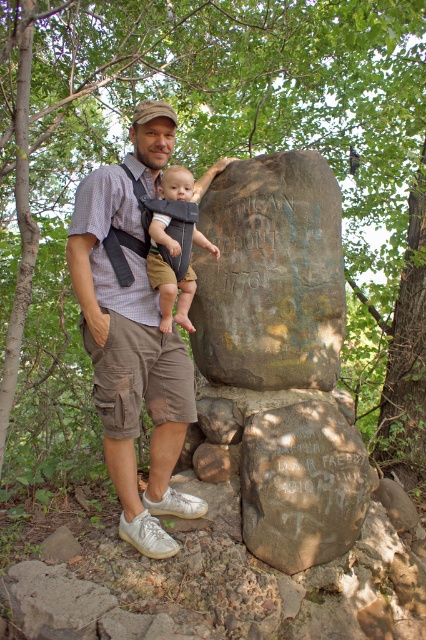
You are standing at the origin point of the coordinate system. The camera is pointing towards the monument. Where is the rusty stone boulder at center located in terms of coordinates?

The rusty stone boulder at center is located at coordinates point (270, 275).

You are a hiker trying to locate the rusty stone boulder at center. From your current position, which direction should you turn to find the brown rough stone at center?

The brown rough stone at center is to the left of the rusty stone boulder at center, so you should turn to your left to locate it.